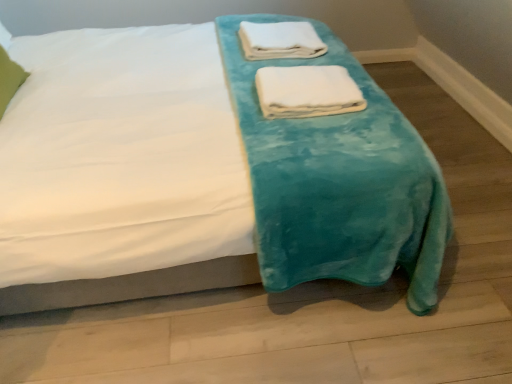
At what (x,y) coordinates should I click in order to perform the action: click on white soft towel at center, which ranks as the 1th towel in bottom-to-top order. Please return your answer as a coordinate pair (x, y). The image size is (512, 384). Looking at the image, I should click on coord(307,91).

You are a GUI agent. You are given a task and a screenshot of the screen. Output one action in this format:
    pyautogui.click(x=<x>, y=<y>)
    Task: Click on the green fabric pillow at upper left
    This screenshot has height=384, width=512.
    Given the screenshot: What is the action you would take?
    pyautogui.click(x=8, y=72)

At what (x,y) coordinates should I click in order to perform the action: click on white soft towel at center, the 1th towel when ordered from front to back. Please return your answer as a coordinate pair (x, y). Looking at the image, I should click on (307, 91).

Can you tell me how much green fabric pillow at upper left and white soft towel at upper center, acting as the 1th towel starting from the top, differ in facing direction?

3.41 degrees separate the facing orientations of green fabric pillow at upper left and white soft towel at upper center, acting as the 1th towel starting from the top.

Which object is further away from the camera, green fabric pillow at upper left or white soft towel at upper center, acting as the 1th towel starting from the top?

white soft towel at upper center, acting as the 1th towel starting from the top.

Between green fabric pillow at upper left and white soft towel at upper center, the 1th towel in the back-to-front sequence, which one has larger size?

Bigger between the two is green fabric pillow at upper left.

Does white soft towel at upper center, the 1th towel in the back-to-front sequence, turn towards teal plush blanket at center?

Yes, white soft towel at upper center, the 1th towel in the back-to-front sequence, is turned towards teal plush blanket at center.

Image resolution: width=512 pixels, height=384 pixels. What are the coordinates of `bed below the white soft towel at upper center, the 1th towel in the back-to-front sequence (from a real-world perspective)` in the screenshot? It's located at (216, 169).

In the scene shown: Would you say white soft towel at upper center, the second towel when ordered from bottom to top, is to the left or to the right of teal plush blanket at center in the picture?

Clearly, white soft towel at upper center, the second towel when ordered from bottom to top, is on the right of teal plush blanket at center in the image.

In the scene shown: From the image's perspective, is white soft towel at upper center, the 1th towel in the back-to-front sequence, on top of teal plush blanket at center?

Yes, from the image's perspective, white soft towel at upper center, the 1th towel in the back-to-front sequence, is on top of teal plush blanket at center.

I want to click on towel located on the left of white soft towel at center, the 1th towel when ordered from front to back, so click(x=280, y=40).

Does point (274, 88) appear closer or farther from the camera than point (309, 57)?

Clearly, point (274, 88) is closer to the camera than point (309, 57).

Between white soft towel at center, acting as the 2th towel starting from the top, and white soft towel at upper center, acting as the 1th towel starting from the top, which one appears on the left side from the viewer's perspective?

white soft towel at upper center, acting as the 1th towel starting from the top, is more to the left.

From a real-world perspective, between white soft towel at upper center, the second towel when ordered from bottom to top, and white soft towel at center, which ranks as the 1th towel in bottom-to-top order, who is vertically higher?

white soft towel at upper center, the second towel when ordered from bottom to top.

Are white soft towel at upper center, acting as the 1th towel starting from the top, and white soft towel at center, the 2th towel in the back-to-front sequence, far apart?

white soft towel at upper center, acting as the 1th towel starting from the top, is near white soft towel at center, the 2th towel in the back-to-front sequence, not far away.

Is white soft towel at upper center, acting as the 1th towel starting from the top, in front of white soft towel at center, the 2th towel in the back-to-front sequence?

No, white soft towel at upper center, acting as the 1th towel starting from the top, is further to the viewer.

Between white soft towel at upper center, the second towel when ordered from bottom to top, and white soft towel at center, the 2th towel in the back-to-front sequence, which one has smaller width?

white soft towel at center, the 2th towel in the back-to-front sequence, is thinner.

Is teal plush blanket at center not near white soft towel at upper center, which is the 2th towel from front to back?

No, teal plush blanket at center is in close proximity to white soft towel at upper center, which is the 2th towel from front to back.

Is white soft towel at upper center, the 1th towel in the back-to-front sequence, a part of teal plush blanket at center?

Yes, white soft towel at upper center, the 1th towel in the back-to-front sequence, is a part of teal plush blanket at center.

From a real-world perspective, is teal plush blanket at center positioned over white soft towel at upper center, which is the 2th towel from front to back, based on gravity?

Incorrect, from a real-world perspective, teal plush blanket at center is lower than white soft towel at upper center, which is the 2th towel from front to back.

Identify the location of bed directly beneath the white soft towel at upper center, which is the 2th towel from front to back (from a real-world perspective). [x=216, y=169].

Is teal plush blanket at center to the left of white soft towel at center, the 1th towel when ordered from front to back, from the viewer's perspective?

Yes, teal plush blanket at center is to the left of white soft towel at center, the 1th towel when ordered from front to back.

Based on the photo, which of these two, teal plush blanket at center or white soft towel at center, the 1th towel when ordered from front to back, stands taller?

teal plush blanket at center.

Considering the sizes of teal plush blanket at center and white soft towel at center, which ranks as the 1th towel in bottom-to-top order, in the image, is teal plush blanket at center bigger or smaller than white soft towel at center, which ranks as the 1th towel in bottom-to-top order,?

In the image, teal plush blanket at center appears to be larger than white soft towel at center, which ranks as the 1th towel in bottom-to-top order.

In terms of height, does teal plush blanket at center look taller or shorter compared to green fabric pillow at upper left?

Considering their sizes, teal plush blanket at center has more height than green fabric pillow at upper left.

The height and width of the screenshot is (384, 512). In order to click on bed located in front of the green fabric pillow at upper left in this screenshot , I will do `click(216, 169)`.

Based on their sizes in the image, would you say teal plush blanket at center is bigger or smaller than green fabric pillow at upper left?

Clearly, teal plush blanket at center is larger in size than green fabric pillow at upper left.

How different are the orientations of teal plush blanket at center and green fabric pillow at upper left in degrees?

The angular difference between teal plush blanket at center and green fabric pillow at upper left is 4.38 degrees.

Where is `pillow below the white soft towel at upper center, the 1th towel in the back-to-front sequence (from the image's perspective)`? The image size is (512, 384). pillow below the white soft towel at upper center, the 1th towel in the back-to-front sequence (from the image's perspective) is located at coordinates (8, 72).

Starting from the teal plush blanket at center, which towel is the 1st one to the right? Please provide its 2D coordinates.

[(280, 40)]

Based on their spatial positions, is white soft towel at center, the 2th towel in the back-to-front sequence, or white soft towel at upper center, the 1th towel in the back-to-front sequence, further from green fabric pillow at upper left?

Among the two, white soft towel at center, the 2th towel in the back-to-front sequence, is located further to green fabric pillow at upper left.

Based on their spatial positions, is green fabric pillow at upper left or white soft towel at upper center, which is the 2th towel from front to back, closer to teal plush blanket at center?

white soft towel at upper center, which is the 2th towel from front to back, is closer to teal plush blanket at center.

Based on their spatial positions, is green fabric pillow at upper left or white soft towel at center, the 1th towel when ordered from front to back, further from teal plush blanket at center?

green fabric pillow at upper left.

Based on their spatial positions, is white soft towel at upper center, acting as the 1th towel starting from the top, or teal plush blanket at center further from green fabric pillow at upper left?

white soft towel at upper center, acting as the 1th towel starting from the top, is positioned further to the anchor green fabric pillow at upper left.

Based on their spatial positions, is white soft towel at upper center, the second towel when ordered from bottom to top, or green fabric pillow at upper left further from white soft towel at center, the 2th towel in the back-to-front sequence?

The object further to white soft towel at center, the 2th towel in the back-to-front sequence, is green fabric pillow at upper left.

When comparing their distances from white soft towel at center, the 1th towel when ordered from front to back, does green fabric pillow at upper left or white soft towel at upper center, which is the 2th towel from front to back, seem further?

Based on the image, green fabric pillow at upper left appears to be further to white soft towel at center, the 1th towel when ordered from front to back.

Looking at the image, which one is located closer to white soft towel at upper center, which is the 2th towel from front to back, white soft towel at center, which ranks as the 1th towel in bottom-to-top order, or teal plush blanket at center?

white soft towel at center, which ranks as the 1th towel in bottom-to-top order, is positioned closer to the anchor white soft towel at upper center, which is the 2th towel from front to back.

Estimate the real-world distances between objects in this image. Which object is closer to teal plush blanket at center, white soft towel at center, the 2th towel in the back-to-front sequence, or green fabric pillow at upper left?

white soft towel at center, the 2th towel in the back-to-front sequence, is closer to teal plush blanket at center.

Identify the location of towel located between teal plush blanket at center and white soft towel at upper center, which is the 2th towel from front to back, in the depth direction. The height and width of the screenshot is (384, 512). (307, 91).

Locate an element on the screen. Image resolution: width=512 pixels, height=384 pixels. bed located between green fabric pillow at upper left and white soft towel at center, the 2th towel in the back-to-front sequence, in the left-right direction is located at coordinates (216, 169).

Find the location of a particular element. This screenshot has width=512, height=384. towel between green fabric pillow at upper left and white soft towel at center, acting as the 2th towel starting from the top, in the horizontal direction is located at coordinates (280, 40).

This screenshot has height=384, width=512. What are the coordinates of `pillow between teal plush blanket at center and white soft towel at upper center, the second towel when ordered from bottom to top, in the front-back direction` in the screenshot? It's located at (8, 72).